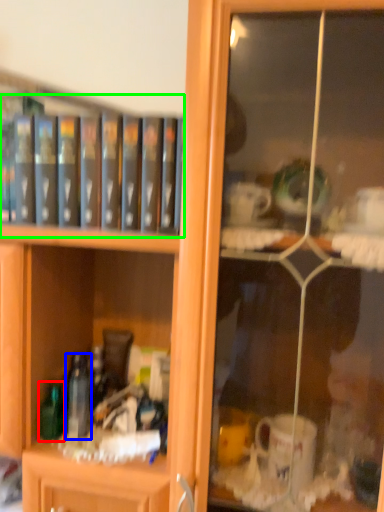
Question: Which object is the farthest from bottle (highlighted by a red box)? Choose among these: bottle (highlighted by a blue box) or book (highlighted by a green box).

Choices:
 (A) bottle
 (B) book

Answer: (B)